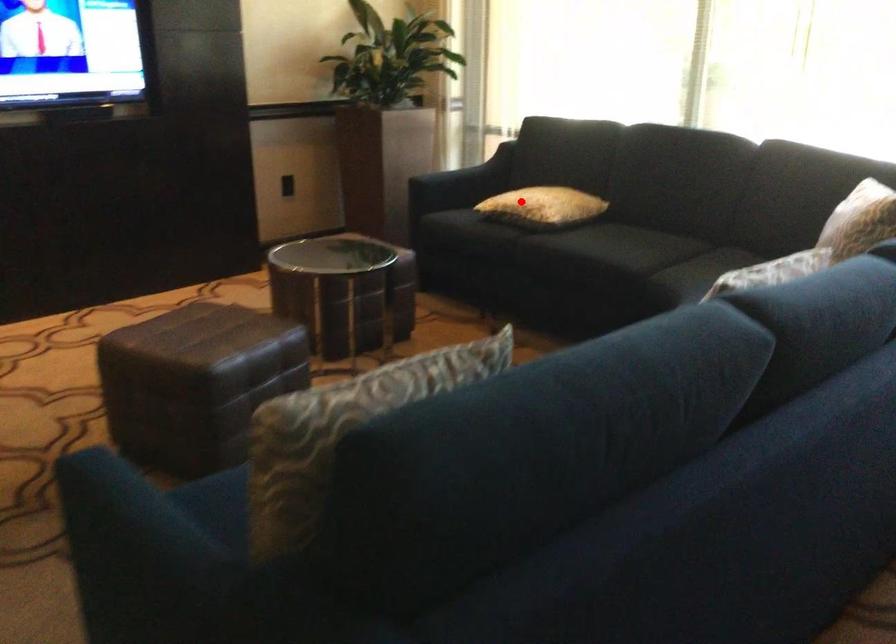
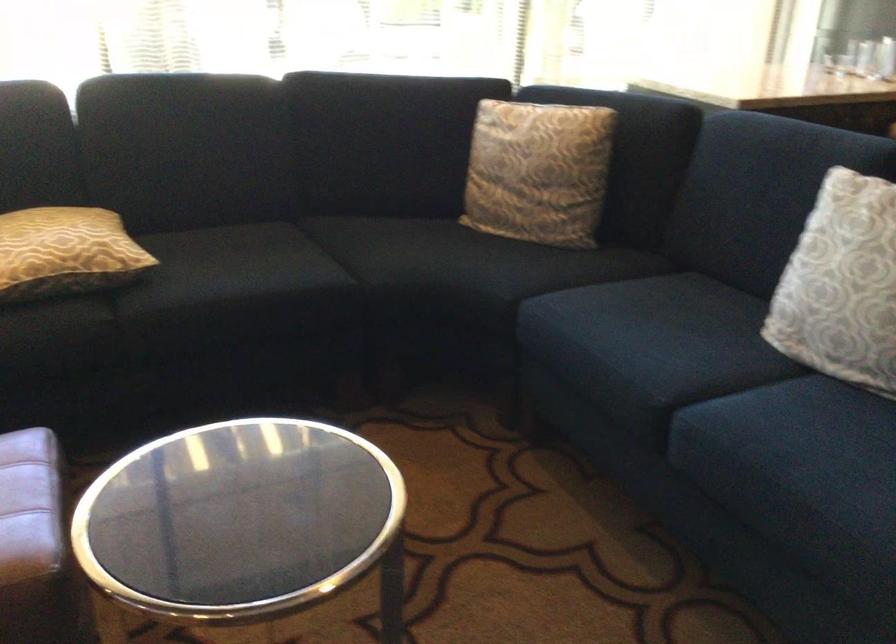
Question: I am providing you with two images of the same scene from different viewpoints. A red point is shown in image1. For the corresponding object point in image2, is it positioned nearer or farther from the camera?

Choices:
 (A) Nearer
 (B) Farther

Answer: (A)